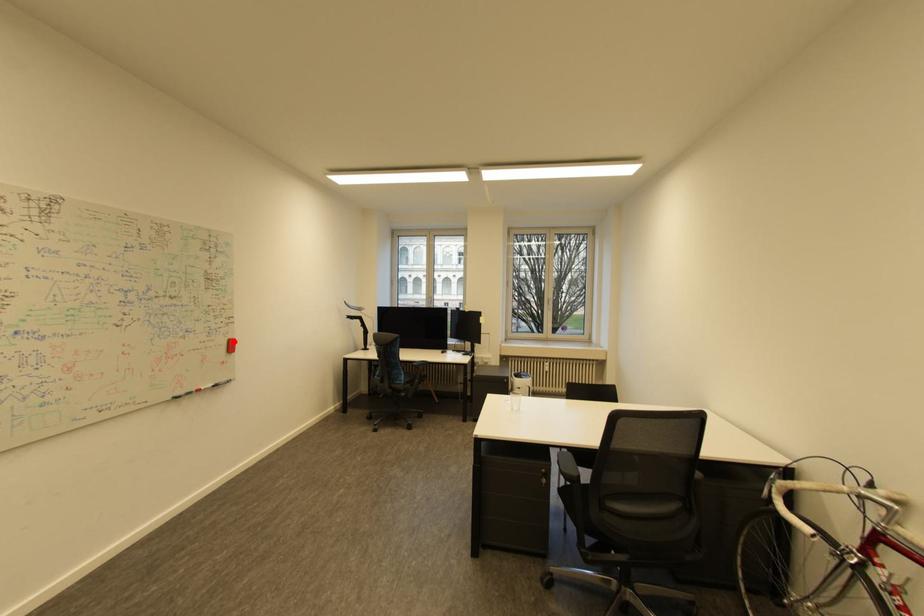
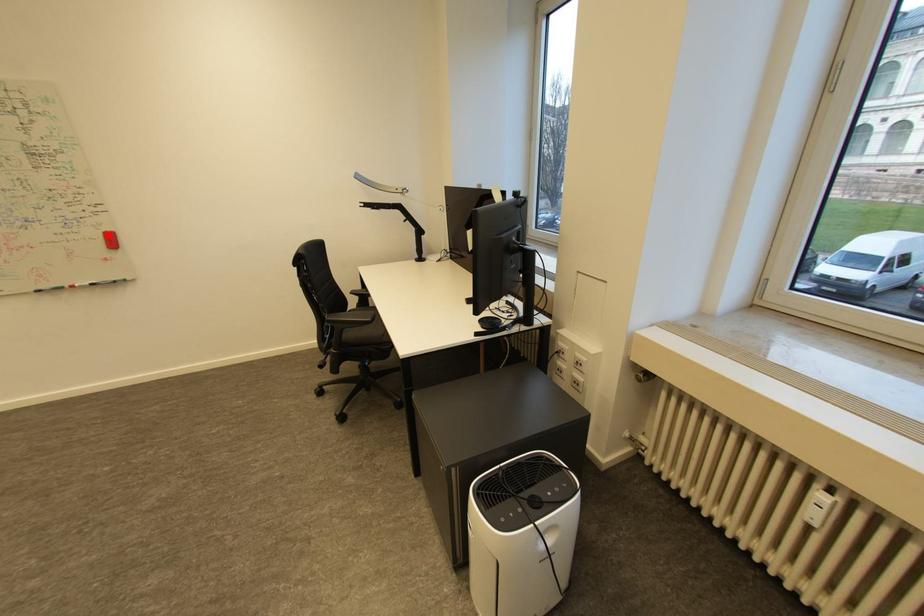
I am providing you with two images of the same scene from different viewpoints. A red point is marked on the first image and another point is marked on the second image. Is the red point in image1 aligned with the point shown in image2?

Yes